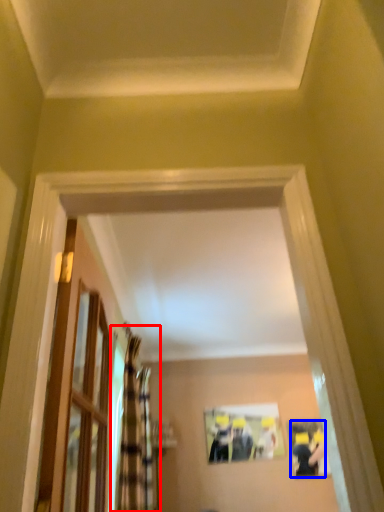
Question: Which point is further to the camera, curtain (highlighted by a red box) or couple (highlighted by a blue box)?

Choices:
 (A) curtain
 (B) couple

Answer: (B)